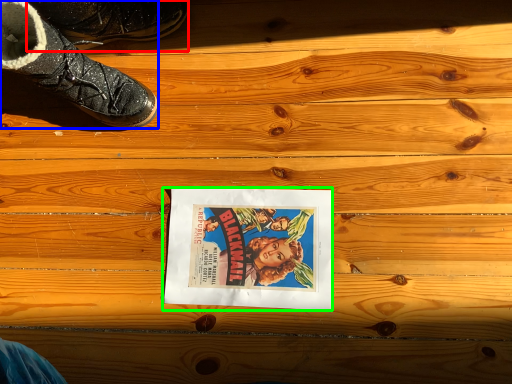
Question: Which object is the farthest from footwear (highlighted by a red box)? Choose among these: footwear (highlighted by a blue box) or movie poster (highlighted by a green box).

Choices:
 (A) footwear
 (B) movie poster

Answer: (B)